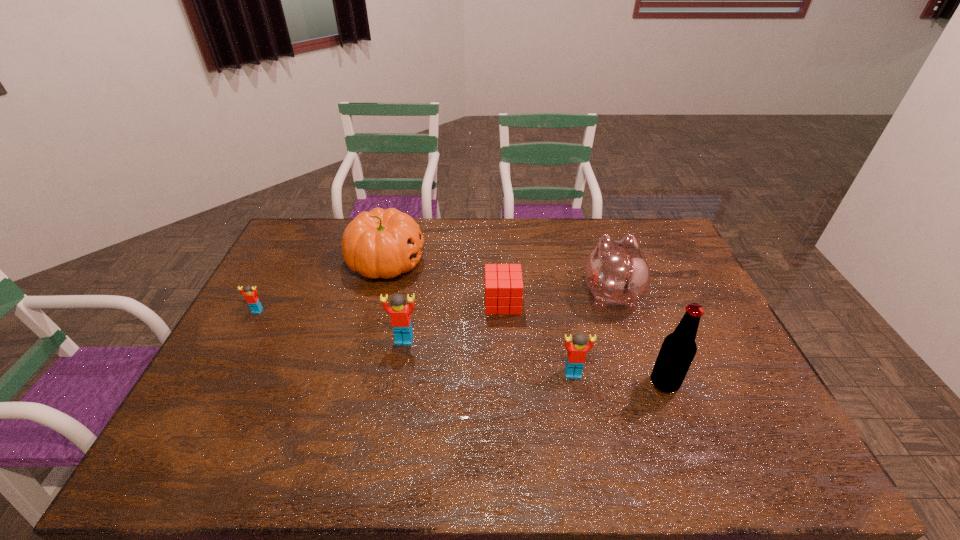
I want to click on free space between the fifth object from left to right and the fourth object from right to left, so click(538, 338).

This screenshot has width=960, height=540. Identify the location of unoccupied position between the piggy bank and the fourth object from right to left. [x=557, y=298].

At what (x,y) coordinates should I click in order to perform the action: click on free space between the leftmost Lego and the beer bottle. Please return your answer as a coordinate pair (x, y). Looking at the image, I should click on (461, 347).

Identify the location of vacant region between the pumpkin and the beer bottle. Image resolution: width=960 pixels, height=540 pixels. pos(525,322).

Select which object appears as the fourth closest to the rightmost Lego. Please provide its 2D coordinates. Your answer should be formatted as a tuple, i.e. [(x, y)], where the tuple contains the x and y coordinates of a point satisfying the conditions above.

[(400, 313)]

Choose which object is the third nearest neighbor to the fourth object from left to right. Please provide its 2D coordinates. Your answer should be formatted as a tuple, i.e. [(x, y)], where the tuple contains the x and y coordinates of a point satisfying the conditions above.

[(400, 313)]

Image resolution: width=960 pixels, height=540 pixels. What are the coordinates of `Lego that stands as the third closest to the cube` in the screenshot? It's located at (251, 297).

Where is `Lego that stands as the closest to the leftmost Lego`? This screenshot has width=960, height=540. Lego that stands as the closest to the leftmost Lego is located at coordinates (400, 313).

Where is `free point that satisfies the following two spatial constraints: 1. on the carved face of the pumpkin; 2. on the left side of the beer bottle`? This screenshot has height=540, width=960. free point that satisfies the following two spatial constraints: 1. on the carved face of the pumpkin; 2. on the left side of the beer bottle is located at coordinates (355, 383).

Image resolution: width=960 pixels, height=540 pixels. I want to click on vacant point that satisfies the following two spatial constraints: 1. on the carved face of the pumpkin; 2. on the left side of the cube, so click(376, 302).